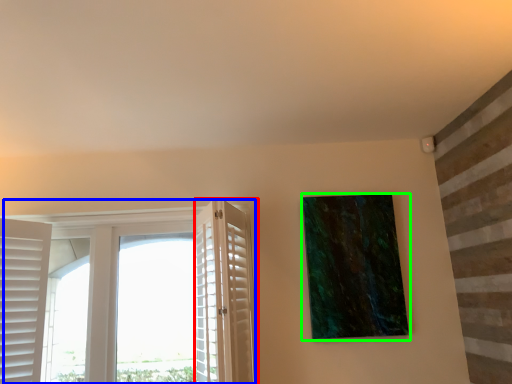
Question: Based on their relative distances, which object is nearer to screen door (highlighted by a red box)? Choose from window (highlighted by a blue box) and picture frame (highlighted by a green box).

Choices:
 (A) window
 (B) picture frame

Answer: (B)